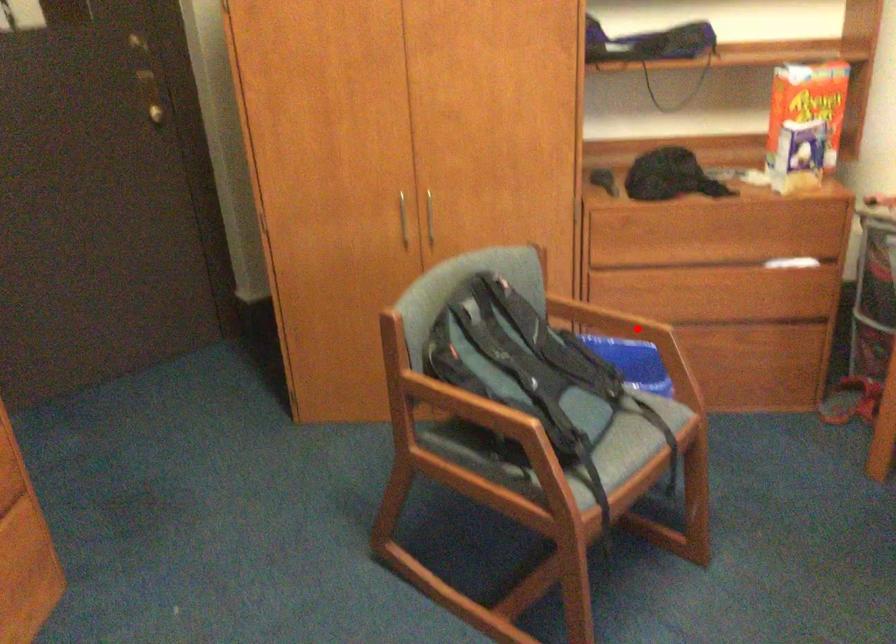
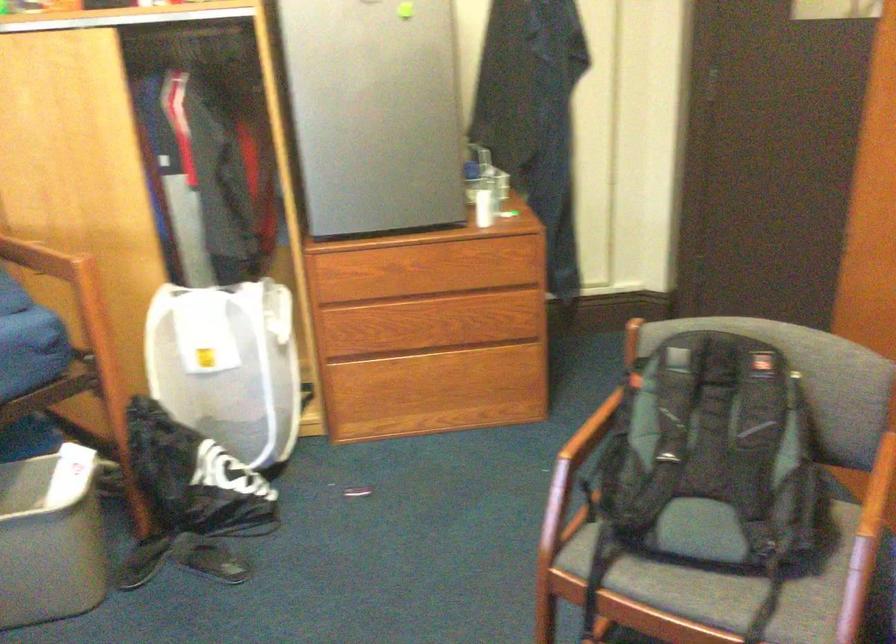
In the second image, find the point that corresponds to the highlighted location in the first image.

(871, 520)